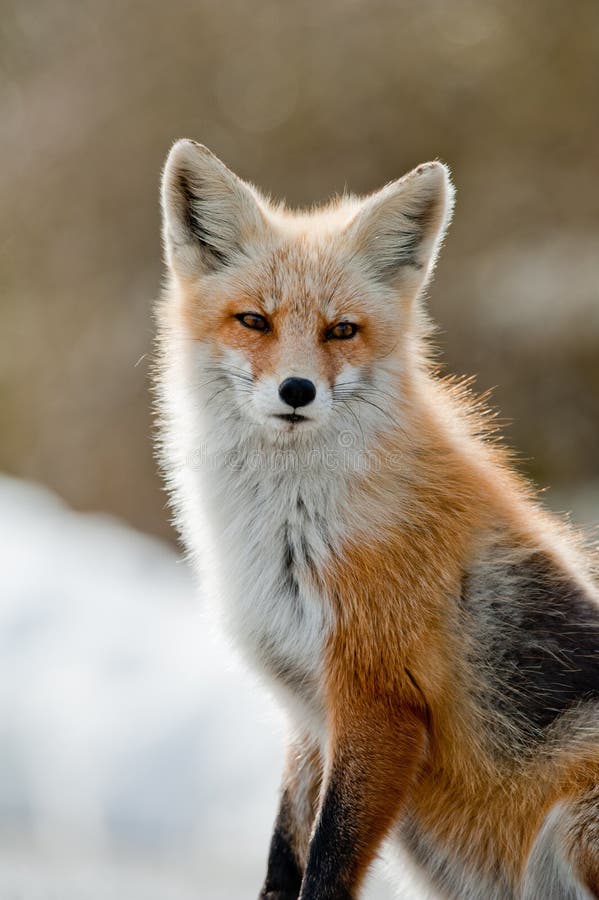
Where is `the chest`? The image size is (599, 900). the chest is located at coordinates (231, 537).